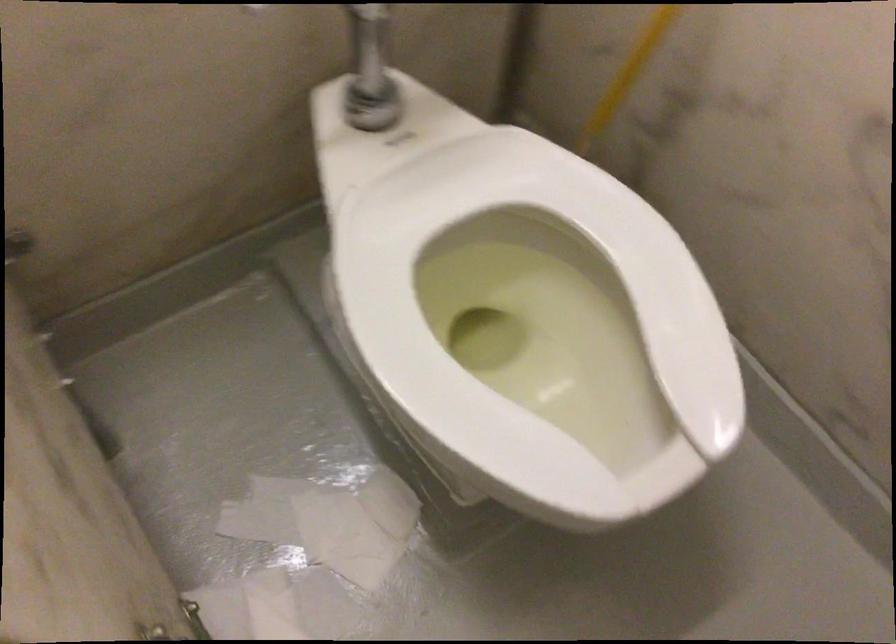
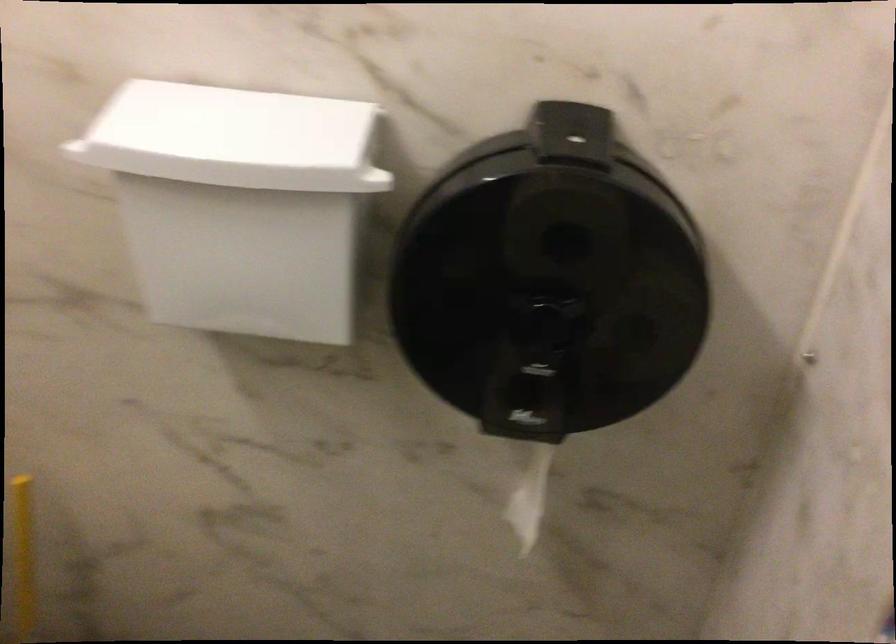
Question: The camera is either moving clockwise (left) or counter-clockwise (right) around the object. The first image is from the beginning of the video and the second image is from the end. Is the camera moving left or right when shooting the video?

Choices:
 (A) Left
 (B) Right

Answer: (A)